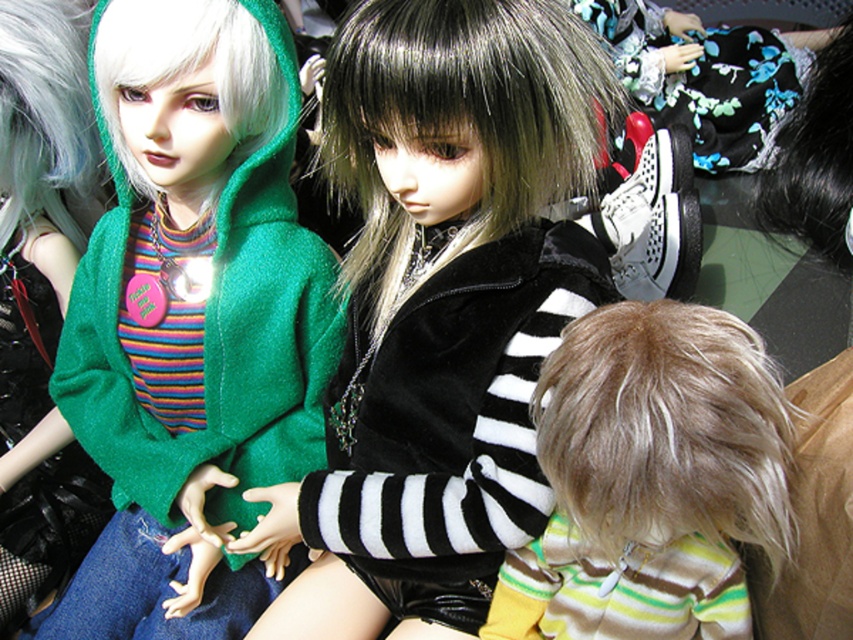
Question: Which of the following is the closest to the observer?

Choices:
 (A) green matte hoodie at left
 (B) velvet black jacket at center
 (C) gray/knit/hair at left

Answer: (B)

Question: From the image, what is the correct spatial relationship of light brown plush hair at center in relation to black silky wig at center?

Choices:
 (A) above
 (B) below

Answer: (B)

Question: Among these points, which one is nearest to the camera?

Choices:
 (A) (271, 93)
 (B) (253, 100)
 (C) (3, 547)

Answer: (B)

Question: Is light brown plush hair at center above green matte hoodie at left?

Choices:
 (A) no
 (B) yes

Answer: (A)

Question: Is velvet black jacket at center wider than black silky hair at upper right?

Choices:
 (A) no
 (B) yes

Answer: (B)

Question: Which object appears farthest from the camera in this image?

Choices:
 (A) gray/knit/hair at left
 (B) velvet black jacket at center
 (C) white matte wig at upper left

Answer: (A)